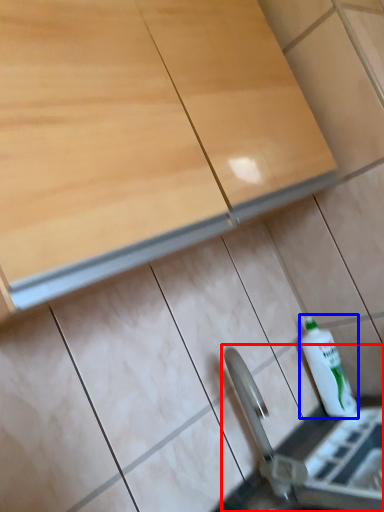
Question: Among these objects, which one is nearest to the camera, sink (highlighted by a red box) or bottle (highlighted by a blue box)?

Choices:
 (A) sink
 (B) bottle

Answer: (A)